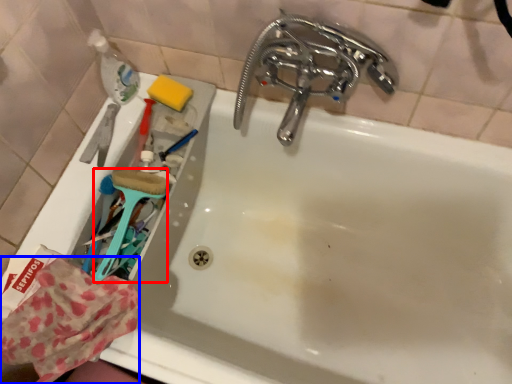
Question: Among these objects, which one is nearest to the camera, brush (highlighted by a red box) or material (highlighted by a blue box)?

Choices:
 (A) brush
 (B) material

Answer: (B)